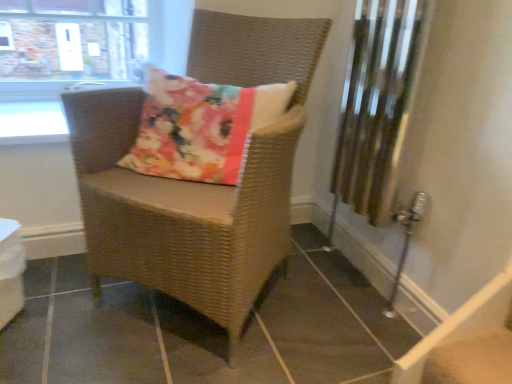
Question: Is white glossy window sill at upper left inside or outside of white glossy table at lower left?

Choices:
 (A) inside
 (B) outside

Answer: (B)

Question: Looking at their shapes, would you say white glossy window sill at upper left is wider or thinner than white glossy table at lower left?

Choices:
 (A) wide
 (B) thin

Answer: (A)

Question: Considering the real-world distances, which object is closest to the woven brown chair at center?

Choices:
 (A) clear glass window at upper left
 (B) white glossy window sill at upper left
 (C) white glossy table at lower left

Answer: (C)

Question: Which object is positioned closest to the woven brown chair at center?

Choices:
 (A) white glossy window sill at upper left
 (B) clear glass window at upper left
 (C) white glossy table at lower left

Answer: (C)